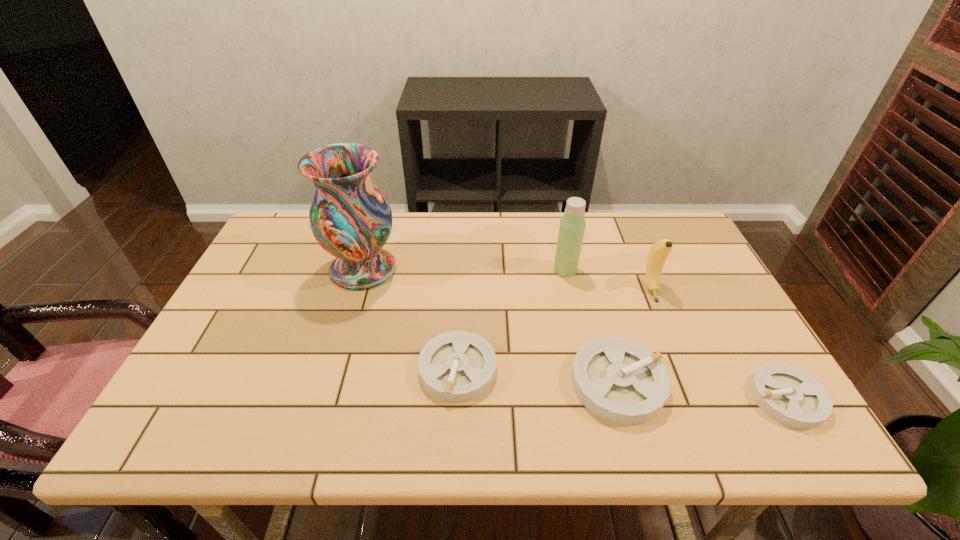
You are a GUI agent. You are given a task and a screenshot of the screen. Output one action in this format:
    pyautogui.click(x=<x>, y=<y>)
    Task: Click on the vacant space that is in between the shortest object and the thermos bottle
    
    Given the screenshot: What is the action you would take?
    pyautogui.click(x=676, y=334)

At what (x,y) coordinates should I click in order to perform the action: click on empty space that is in between the banana and the rightmost object. Please return your answer as a coordinate pair (x, y). Image resolution: width=960 pixels, height=540 pixels. Looking at the image, I should click on (719, 344).

Where is `vacant space that's between the rightmost object and the thermos bottle`? This screenshot has height=540, width=960. vacant space that's between the rightmost object and the thermos bottle is located at coordinates point(676,334).

This screenshot has width=960, height=540. I want to click on vacant area that lies between the third tallest object and the rightmost object, so click(x=719, y=344).

Select which object is the third closest to the second ashtray from right to left. Please provide its 2D coordinates. Your answer should be formatted as a tuple, i.e. [(x, y)], where the tuple contains the x and y coordinates of a point satisfying the conditions above.

[(789, 395)]

You are a GUI agent. You are given a task and a screenshot of the screen. Output one action in this format:
    pyautogui.click(x=<x>, y=<y>)
    Task: Click on the object that stands as the fifth closest to the second tallest object
    The height and width of the screenshot is (540, 960).
    Given the screenshot: What is the action you would take?
    pyautogui.click(x=789, y=395)

Select which ashtray is the second closest to the fourth shortest object. Please provide its 2D coordinates. Your answer should be formatted as a tuple, i.e. [(x, y)], where the tuple contains the x and y coordinates of a point satisfying the conditions above.

[(789, 395)]

Locate an element on the screen. ashtray that is the closest to the second tallest object is located at coordinates (621, 381).

Where is `vacant space that satisfies the following two spatial constraints: 1. from the stem of the third tallest object; 2. on the left side of the shortest ashtray`? Image resolution: width=960 pixels, height=540 pixels. vacant space that satisfies the following two spatial constraints: 1. from the stem of the third tallest object; 2. on the left side of the shortest ashtray is located at coordinates (696, 399).

You are a GUI agent. You are given a task and a screenshot of the screen. Output one action in this format:
    pyautogui.click(x=<x>, y=<y>)
    Task: Click on the free space that satisfies the following two spatial constraints: 1. on the front side of the leftmost object; 2. on the left side of the shortest ashtray
    The image size is (960, 540).
    Given the screenshot: What is the action you would take?
    pyautogui.click(x=324, y=399)